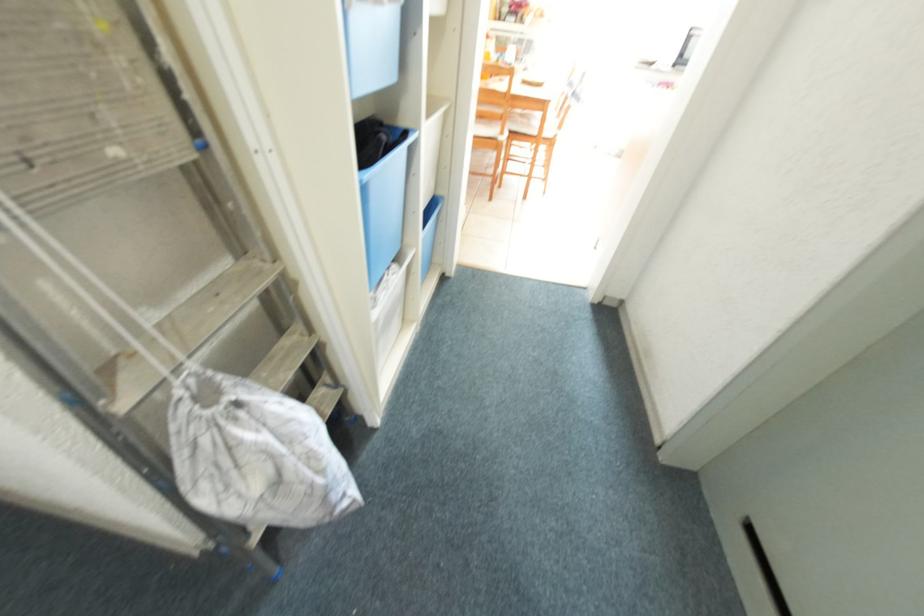
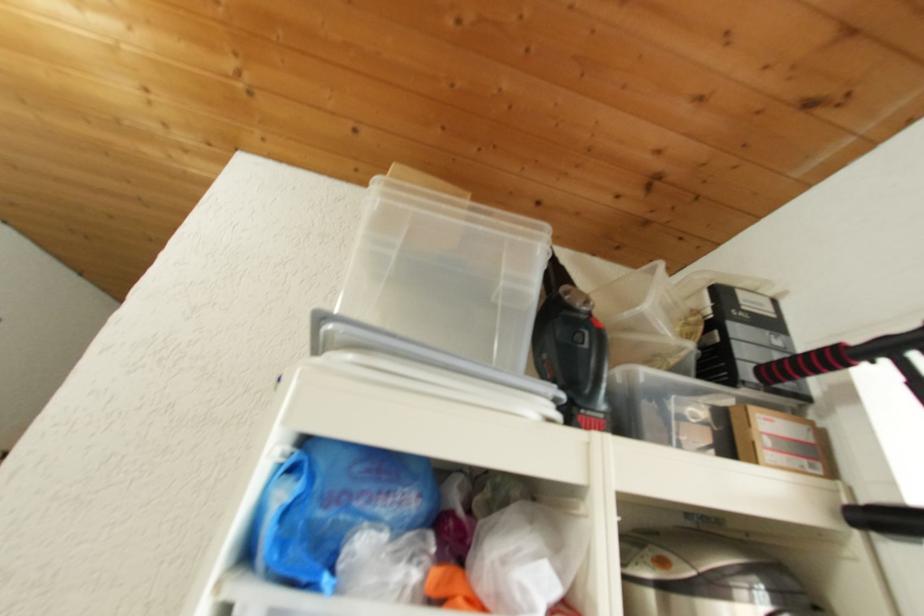
First-person continuous shooting, in which direction is the camera rotating?

The camera rotated toward left-up.